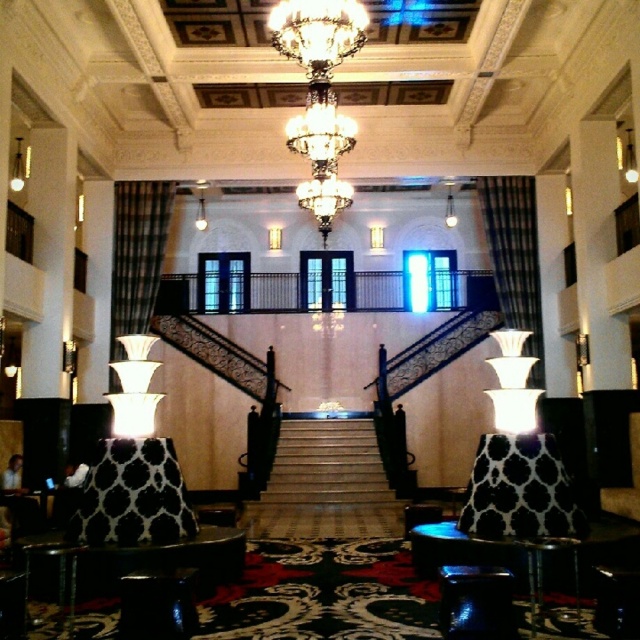
Between crystal glass chandelier at center and black wrought iron staircase at center, which one is positioned lower?

black wrought iron staircase at center is below.

Can you confirm if crystal glass chandelier at center is taller than black wrought iron staircase at center?

No, crystal glass chandelier at center is not taller than black wrought iron staircase at center.

Is point (291, 145) positioned behind point (397, 358)?

No, it is not.

I want to click on crystal glass chandelier at center, so click(x=320, y=93).

Between dark wood staircase at center and black wrought iron staircase at center, which one is positioned lower?

dark wood staircase at center is below.

Between point (161, 332) and point (436, 365), which one is positioned behind?

Point (161, 332)

Locate an element on the screen. dark wood staircase at center is located at coordinates (220, 356).

Can you confirm if crystal glass chandelier at center is thinner than white marble stairs at center?

Yes, crystal glass chandelier at center is thinner than white marble stairs at center.

Describe the element at coordinates (320, 93) in the screenshot. This screenshot has width=640, height=640. I see `crystal glass chandelier at center` at that location.

Where is `crystal glass chandelier at center`? This screenshot has height=640, width=640. crystal glass chandelier at center is located at coordinates (320, 93).